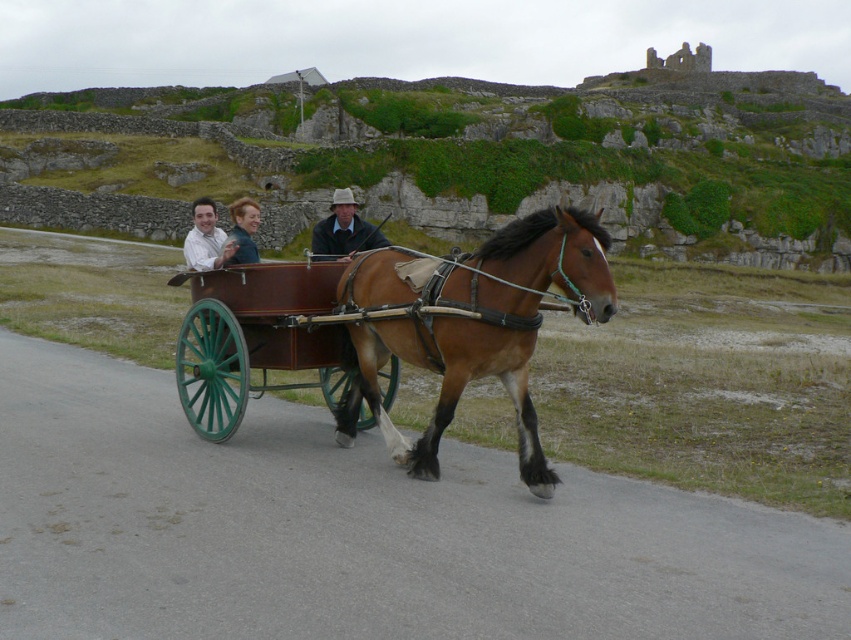
You are a delivery person trying to load a package onto the wooden wagon at center. You notice the light brown leather jacket at center is already on the wagon. Based on their sizes, can you place the package on top of the jacket without it slipping off?

The wooden wagon at center has a lesser height compared to light brown leather jacket at center, meaning the jacket is taller. This means the package placed on top of the jacket might not have a stable base and could slip off easily.

You are standing at the origin point in the image. Where is the brown glossy horse at center located in terms of coordinates?

The brown glossy horse at center is located at coordinates point (472, 326).